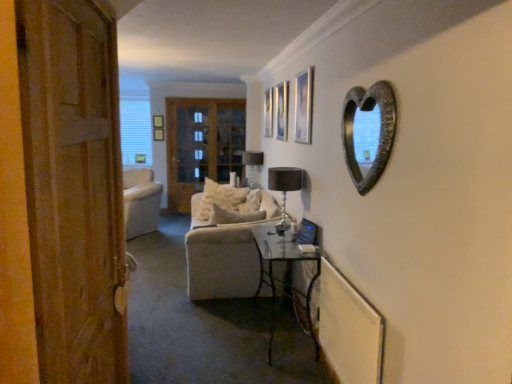
Locate an element on the screen. matte wooden picture frame at upper center, marked as the 1th picture frame in a left-to-right arrangement is located at coordinates (268, 112).

The height and width of the screenshot is (384, 512). In order to click on white fabric couch at center in this screenshot , I will do `click(234, 204)`.

What do you see at coordinates (202, 145) in the screenshot? I see `clear glass door at center` at bounding box center [202, 145].

Measure the distance between point [278,188] and camera.

Point [278,188] and camera are 3.51 meters apart.

Image resolution: width=512 pixels, height=384 pixels. What do you see at coordinates (285, 188) in the screenshot?
I see `black glass lamp at center, the 2th lamp viewed from the left` at bounding box center [285, 188].

This screenshot has width=512, height=384. Describe the element at coordinates (74, 188) in the screenshot. I see `wooden door at left` at that location.

The height and width of the screenshot is (384, 512). In order to click on metallic silver picture frame at upper center, which is the second picture frame from left to right in this screenshot , I will do `click(282, 110)`.

Where is `matte wooden picture frame at upper center, positioned as the 1th picture frame in back-to-front order`? matte wooden picture frame at upper center, positioned as the 1th picture frame in back-to-front order is located at coordinates (268, 112).

From a real-world perspective, relative to matte black lampshade at center, the second lamp from the right, is matte wooden picture frame at upper center, positioned as the 1th picture frame in back-to-front order, vertically above or below?

In terms of real-world spatial position, matte wooden picture frame at upper center, positioned as the 1th picture frame in back-to-front order, is above matte black lampshade at center, the second lamp from the right.

Is matte wooden picture frame at upper center, which is the third picture frame from right to left, aimed at matte black lampshade at center, the first lamp in the back-to-front sequence?

No, matte wooden picture frame at upper center, which is the third picture frame from right to left, is not turned towards matte black lampshade at center, the first lamp in the back-to-front sequence.

Is point (266, 92) farther from viewer compared to point (255, 178)?

No, (266, 92) is closer to viewer.

There is a matte black lampshade at center, the first lamp in the back-to-front sequence. In order to click on the 3rd picture frame above it (from the image's perspective) in this screenshot , I will do `click(268, 112)`.

Is black glass lamp at center, which appears as the 1th lamp when viewed from the right, looking in the opposite direction of matte wooden picture frame at upper center, marked as the 1th picture frame in a left-to-right arrangement?

No, black glass lamp at center, which appears as the 1th lamp when viewed from the right, is not facing the opposite direction of matte wooden picture frame at upper center, marked as the 1th picture frame in a left-to-right arrangement.

Based on the photo, which object is further away from the camera taking this photo, black glass lamp at center, which appears as the 1th lamp when viewed from the front, or matte wooden picture frame at upper center, marked as the 1th picture frame in a left-to-right arrangement?

Positioned behind is matte wooden picture frame at upper center, marked as the 1th picture frame in a left-to-right arrangement.

From the image's perspective, is black glass lamp at center, placed as the second lamp when sorted from back to front, above or below matte wooden picture frame at upper center, positioned as the 1th picture frame in back-to-front order?

Based on their image positions, black glass lamp at center, placed as the second lamp when sorted from back to front, is located beneath matte wooden picture frame at upper center, positioned as the 1th picture frame in back-to-front order.

In terms of size, does black glass lamp at center, placed as the second lamp when sorted from back to front, appear bigger or smaller than matte wooden picture frame at upper center, marked as the 1th picture frame in a left-to-right arrangement?

black glass lamp at center, placed as the second lamp when sorted from back to front, is bigger than matte wooden picture frame at upper center, marked as the 1th picture frame in a left-to-right arrangement.

Is rustic wood heart-shaped mirror at upper right oriented away from clear glass door at center?

No, clear glass door at center is not at the back of rustic wood heart-shaped mirror at upper right.

From a real-world perspective, which object stands above the other?

rustic wood heart-shaped mirror at upper right, from a real-world perspective.

Considering their positions, is rustic wood heart-shaped mirror at upper right located in front of or behind clear glass door at center?

In the image, rustic wood heart-shaped mirror at upper right appears in front of clear glass door at center.

Based on their positions, is rustic wood heart-shaped mirror at upper right located to the left or right of clear glass door at center?

Clearly, rustic wood heart-shaped mirror at upper right is on the right of clear glass door at center in the image.

Considering the relative positions of rustic wood heart-shaped mirror at upper right and metallic glass table at lower center in the image provided, is rustic wood heart-shaped mirror at upper right to the left of metallic glass table at lower center from the viewer's perspective?

No, rustic wood heart-shaped mirror at upper right is not to the left of metallic glass table at lower center.

Do you think rustic wood heart-shaped mirror at upper right is within metallic glass table at lower center, or outside of it?

rustic wood heart-shaped mirror at upper right is spatially situated outside metallic glass table at lower center.

From a real-world perspective, is rustic wood heart-shaped mirror at upper right on metallic glass table at lower center?

Yes, from a real-world perspective, rustic wood heart-shaped mirror at upper right is above metallic glass table at lower center.

Considering the positions of point (374, 105) and point (274, 254), is point (374, 105) closer or farther from the camera than point (274, 254)?

Point (374, 105) is positioned closer to the camera compared to point (274, 254).

Can you confirm if metallic glass table at lower center is smaller than matte black lampshade at center, the second lamp from the right?

No, metallic glass table at lower center is not smaller than matte black lampshade at center, the second lamp from the right.

Is metallic glass table at lower center in contact with matte black lampshade at center, the first lamp in the back-to-front sequence?

metallic glass table at lower center and matte black lampshade at center, the first lamp in the back-to-front sequence, are clearly separated.

In order to click on table below the matte black lampshade at center, the first lamp in the back-to-front sequence (from the image's perspective) in this screenshot , I will do `click(286, 267)`.

Does metallic glass table at lower center contain matte black lampshade at center, the second lamp viewed from the front?

Actually, matte black lampshade at center, the second lamp viewed from the front, is outside metallic glass table at lower center.

Considering the sizes of objects metallic glass table at lower center and rustic wood heart-shaped mirror at upper right in the image provided, who is bigger, metallic glass table at lower center or rustic wood heart-shaped mirror at upper right?

metallic glass table at lower center is bigger.

From the image's perspective, is metallic glass table at lower center positioned above or below rustic wood heart-shaped mirror at upper right?

metallic glass table at lower center is situated lower than rustic wood heart-shaped mirror at upper right in the image.

Is metallic glass table at lower center positioned far away from rustic wood heart-shaped mirror at upper right?

metallic glass table at lower center is far away from rustic wood heart-shaped mirror at upper right.

Are clear glass door at center and metallic silver picture frame at upper center, which is the second picture frame from left to right, beside each other?

There is a gap between clear glass door at center and metallic silver picture frame at upper center, which is the second picture frame from left to right.

Between clear glass door at center and metallic silver picture frame at upper center, which is the second picture frame in front-to-back order, which one appears on the right side from the viewer's perspective?

metallic silver picture frame at upper center, which is the second picture frame in front-to-back order, is more to the right.

You are a GUI agent. You are given a task and a screenshot of the screen. Output one action in this format:
    pyautogui.click(x=<x>, y=<y>)
    Task: Click on the screen door located on the left of metallic silver picture frame at upper center, the second picture frame viewed from the back
    
    Given the screenshot: What is the action you would take?
    pyautogui.click(x=202, y=145)

Does point (230, 103) come behind point (284, 130)?

Yes, point (230, 103) is behind point (284, 130).

Where is `lamp behind the matte wooden picture frame at upper center, marked as the 1th picture frame in a left-to-right arrangement`? The width and height of the screenshot is (512, 384). lamp behind the matte wooden picture frame at upper center, marked as the 1th picture frame in a left-to-right arrangement is located at coordinates (252, 167).

The width and height of the screenshot is (512, 384). In order to click on lamp in front of the matte wooden picture frame at upper center, positioned as the 1th picture frame in back-to-front order in this screenshot , I will do `click(285, 188)`.

When comparing their distances from white fabric couch at center, does matte wooden picture frame at upper center, the third picture frame when ordered from left to right, or black glass lamp at center, the 2th lamp viewed from the left, seem closer?

The object closer to white fabric couch at center is black glass lamp at center, the 2th lamp viewed from the left.

When comparing their distances from metallic silver picture frame at upper center, positioned as the 2th picture frame in right-to-left order, does black glass lamp at center, which appears as the 1th lamp when viewed from the right, or wooden door at left seem further?

Among the two, wooden door at left is located further to metallic silver picture frame at upper center, positioned as the 2th picture frame in right-to-left order.

Based on their spatial positions, is rustic wood heart-shaped mirror at upper right or metallic glass table at lower center further from matte wooden picture frame at upper center, which is counted as the 3th picture frame, starting from the back?

rustic wood heart-shaped mirror at upper right.

Considering their positions, is clear glass door at center positioned closer to black glass lamp at center, placed as the second lamp when sorted from back to front, than rustic wood heart-shaped mirror at upper right?

rustic wood heart-shaped mirror at upper right lies closer to black glass lamp at center, placed as the second lamp when sorted from back to front, than the other object.

Estimate the real-world distances between objects in this image. Which object is closer to metallic silver picture frame at upper center, the second picture frame viewed from the back, white fabric couch at center or matte wooden picture frame at upper center, the third picture frame when ordered from left to right?

Based on the image, matte wooden picture frame at upper center, the third picture frame when ordered from left to right, appears to be nearer to metallic silver picture frame at upper center, the second picture frame viewed from the back.

From the image, which object appears to be nearer to black glass lamp at center, which appears as the 1th lamp when viewed from the right, metallic silver picture frame at upper center, the second picture frame viewed from the back, or white fabric couch at center?

The object closer to black glass lamp at center, which appears as the 1th lamp when viewed from the right, is white fabric couch at center.

Considering their positions, is metallic silver picture frame at upper center, which is the second picture frame from left to right, positioned further to metallic glass table at lower center than wooden door at left?

wooden door at left lies further to metallic glass table at lower center than the other object.

Looking at the image, which one is located closer to metallic glass table at lower center, wooden door at left or clear glass door at center?

Among the two, wooden door at left is located nearer to metallic glass table at lower center.

You are a GUI agent. You are given a task and a screenshot of the screen. Output one action in this format:
    pyautogui.click(x=<x>, y=<y>)
    Task: Click on the couch between rustic wood heart-shaped mirror at upper right and matte black lampshade at center, the first lamp in the back-to-front sequence, along the z-axis
    Image resolution: width=512 pixels, height=384 pixels.
    Given the screenshot: What is the action you would take?
    pyautogui.click(x=234, y=204)

Image resolution: width=512 pixels, height=384 pixels. What are the coordinates of `couch between black glass lamp at center, the 2th lamp viewed from the left, and clear glass door at center, along the z-axis` in the screenshot? It's located at (234, 204).

The image size is (512, 384). In order to click on picture frame between wooden door at left and metallic silver picture frame at upper center, which is the second picture frame from left to right, along the z-axis in this screenshot , I will do `click(304, 106)`.

At what (x,y) coordinates should I click in order to perform the action: click on picture frame positioned between rustic wood heart-shaped mirror at upper right and metallic silver picture frame at upper center, which is the second picture frame in front-to-back order, from near to far. Please return your answer as a coordinate pair (x, y). The width and height of the screenshot is (512, 384). Looking at the image, I should click on (304, 106).